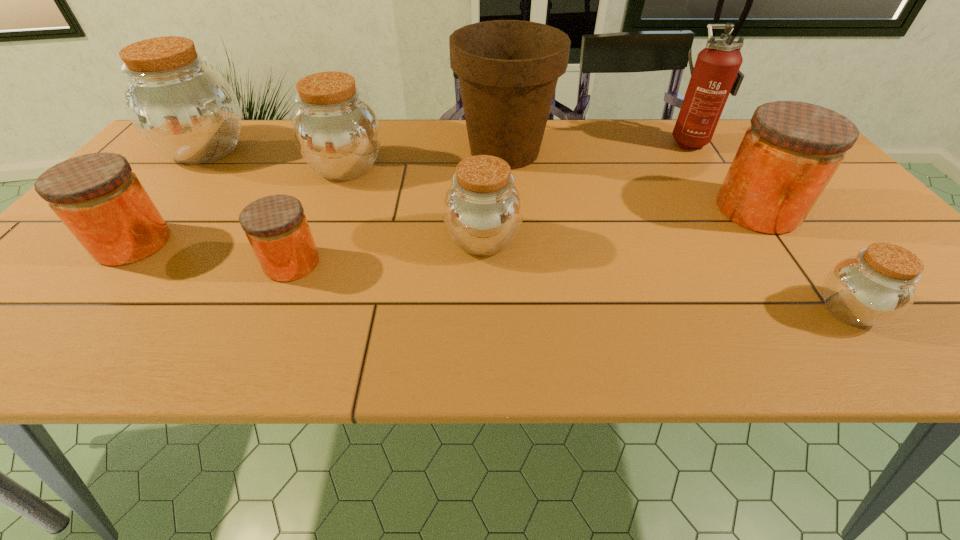
You are a GUI agent. You are given a task and a screenshot of the screen. Output one action in this format:
    pyautogui.click(x=<x>, y=<y>)
    Task: Click on the blank region between the second biggest brown jar and the nearest brown jar
    The image size is (960, 540).
    Given the screenshot: What is the action you would take?
    pyautogui.click(x=597, y=239)

Find the location of `free point between the third brown jar from right to left and the biggest brown jar`. free point between the third brown jar from right to left and the biggest brown jar is located at coordinates (276, 158).

At what (x,y) coordinates should I click in order to perform the action: click on vacant area between the third smallest brown jar and the third jar from right to left. Please return your answer as a coordinate pair (x, y). The width and height of the screenshot is (960, 540). Looking at the image, I should click on click(415, 204).

This screenshot has height=540, width=960. Identify the location of free area in between the tallest jar and the tallest object. (447, 145).

Locate an element on the screen. The height and width of the screenshot is (540, 960). free spot between the tallest object and the fifth jar from left to right is located at coordinates (586, 190).

Find the location of a particular element. Image resolution: width=960 pixels, height=540 pixels. vacant area between the second orange jar from left to right and the third smallest brown jar is located at coordinates (319, 215).

Where is `object that is the closest to the rightmost brown jar`? The height and width of the screenshot is (540, 960). object that is the closest to the rightmost brown jar is located at coordinates (788, 155).

Select which object appears as the fourth closest to the third brown jar from left to right. Please provide its 2D coordinates. Your answer should be formatted as a tuple, i.e. [(x, y)], where the tuple contains the x and y coordinates of a point satisfying the conditions above.

[(788, 155)]

Locate which jar is the fourth closest to the tallest jar. Please provide its 2D coordinates. Your answer should be formatted as a tuple, i.e. [(x, y)], where the tuple contains the x and y coordinates of a point satisfying the conditions above.

[(483, 210)]

Point out which jar is positioned as the third nearest to the third smallest brown jar. Please provide its 2D coordinates. Your answer should be formatted as a tuple, i.e. [(x, y)], where the tuple contains the x and y coordinates of a point satisfying the conditions above.

[(276, 226)]